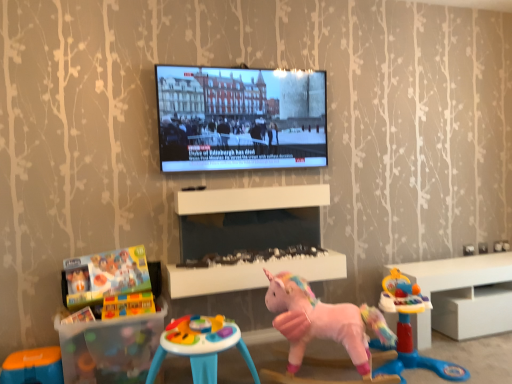
Question: Based on their sizes in the image, would you say multicolored plastic activity table at center, the third toy in the right-to-left sequence, is bigger or smaller than brick-like plastic blocks at lower left, the 3th toy in the left-to-right sequence?

Choices:
 (A) big
 (B) small

Answer: (A)

Question: Is multicolored plastic activity table at center, the fourth toy in the left-to-right sequence, in front of or behind brick-like plastic blocks at lower left, the 3th toy in the left-to-right sequence, in the image?

Choices:
 (A) behind
 (B) front

Answer: (B)

Question: Which is nearer to the pink plush unicorn at center, which is counted as the 5th toy, starting from the left?

Choices:
 (A) translucent plastic building blocks at lower left, which appears as the second toy when viewed from the left
 (B) brick-like plastic blocks at lower left, marked as the 4th toy in a right-to-left arrangement
 (C) translucent plastic table at lower left, the 1th table from the bottom
 (D) orange plastic stool at lower left, the sixth toy when ordered from right to left
 (E) pink fabric unicorn at center, which appears as the 6th toy when viewed from the left

Answer: (E)

Question: Considering the real-world distances, which object is farthest from the white glossy cabinet at right?

Choices:
 (A) brick-like plastic blocks at lower left, the 3th toy in the left-to-right sequence
 (B) translucent plastic table at lower left, the second table viewed from the top
 (C) matte black screen at upper center
 (D) smooth plastic table at center, which is the second table from left to right
 (E) pink plush unicorn at center, the 2th toy positioned from the right

Answer: (A)